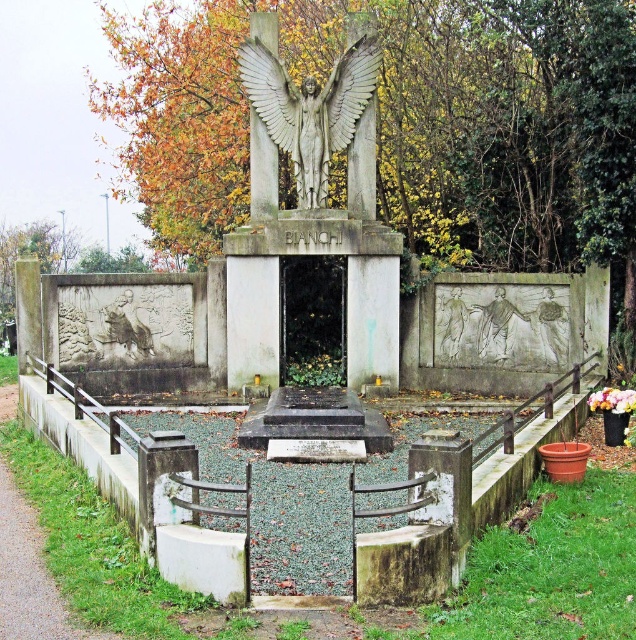
You are a tour guide explaining the mausoleum to visitors. You point out two points on the left panel. The first point is at coordinate point (318, 93) and the second is at point (314, 102). Which of these two points is closer to the front of the panel?

Point (314, 102) is closer to the front of the panel because it is in front of point (318, 93).